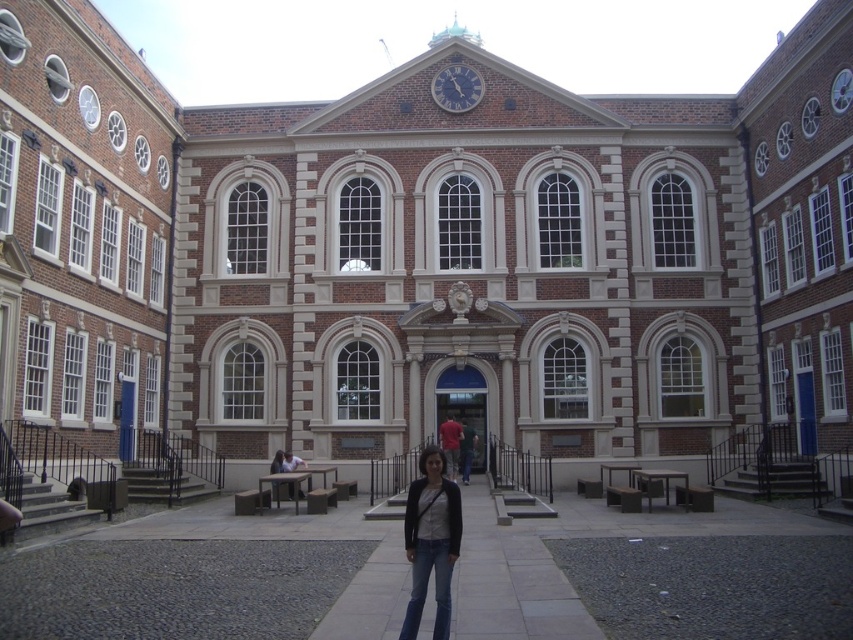
Based on the photo, you are standing in the courtyard of the historic building and see the denim jeans at center and the blue painted metal clock at upper center. Which object is closer to you?

The denim jeans at center is closer to you because it is in front of the blue painted metal clock at upper center.